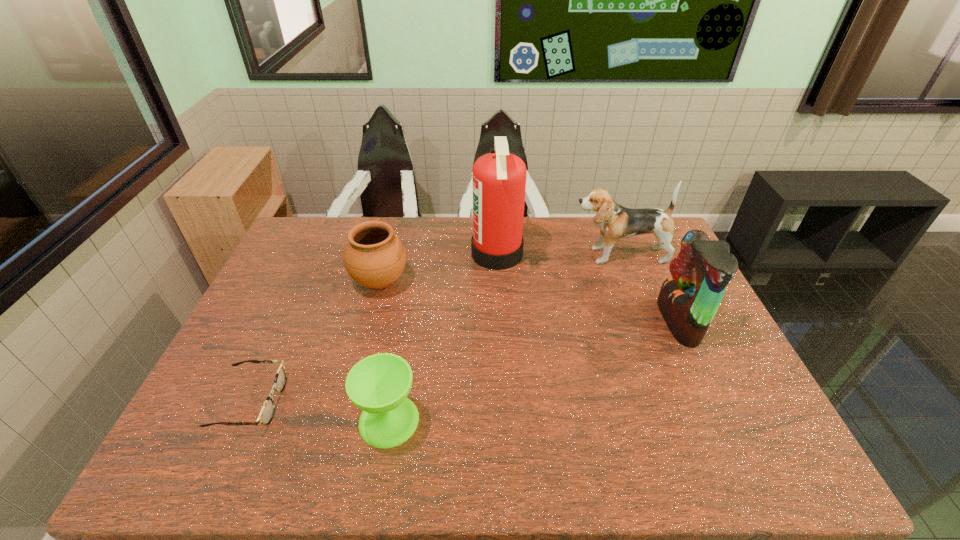
Where is `fire extinguisher at the far edge`? The height and width of the screenshot is (540, 960). fire extinguisher at the far edge is located at coordinates [x=499, y=178].

Where is `puppy present at the far edge`? This screenshot has height=540, width=960. puppy present at the far edge is located at coordinates (616, 222).

Identify the location of object present at the near edge. (379, 384).

Identify the location of object that is at the left edge. This screenshot has width=960, height=540. (266, 414).

Identify the location of puppy that is at the right edge. (616, 222).

Where is `parrot at the right edge`? parrot at the right edge is located at coordinates (688, 300).

In order to click on object present at the far right corner in this screenshot , I will do `click(616, 222)`.

Find the location of a particular element. The width and height of the screenshot is (960, 540). free space at the far edge is located at coordinates (431, 244).

At what (x,y) coordinates should I click in order to perform the action: click on vacant area at the left edge. Please return your answer as a coordinate pair (x, y). Image resolution: width=960 pixels, height=540 pixels. Looking at the image, I should click on (224, 379).

At what (x,y) coordinates should I click in order to perform the action: click on vacant space at the right edge of the desktop. Please return your answer as a coordinate pair (x, y). Image resolution: width=960 pixels, height=540 pixels. Looking at the image, I should click on (706, 347).